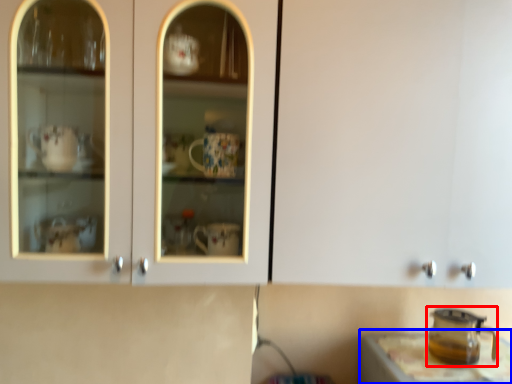
Question: Which object appears closest to the camera in this image, appliance (highlighted by a red box) or table (highlighted by a blue box)?

Choices:
 (A) appliance
 (B) table

Answer: (B)